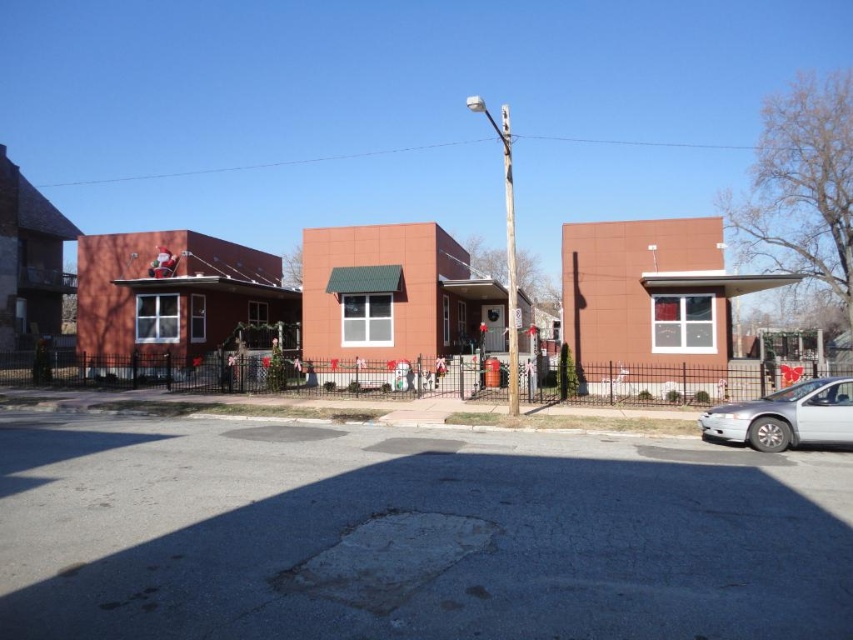
Question: Does silver metallic sedan at lower right have a larger size compared to white wooden pole at center?

Choices:
 (A) yes
 (B) no

Answer: (B)

Question: Is silver metallic sedan at lower right positioned in front of white wooden pole at center?

Choices:
 (A) no
 (B) yes

Answer: (B)

Question: Which of the following is the closest to the observer?

Choices:
 (A) (708, 433)
 (B) (479, 108)

Answer: (A)

Question: Can you confirm if silver metallic sedan at lower right is smaller than white wooden pole at center?

Choices:
 (A) yes
 (B) no

Answer: (A)

Question: Which point is farther to the camera?

Choices:
 (A) (515, 292)
 (B) (727, 436)

Answer: (A)

Question: Which object is closer to the camera taking this photo?

Choices:
 (A) silver metallic sedan at lower right
 (B) white wooden pole at center

Answer: (A)